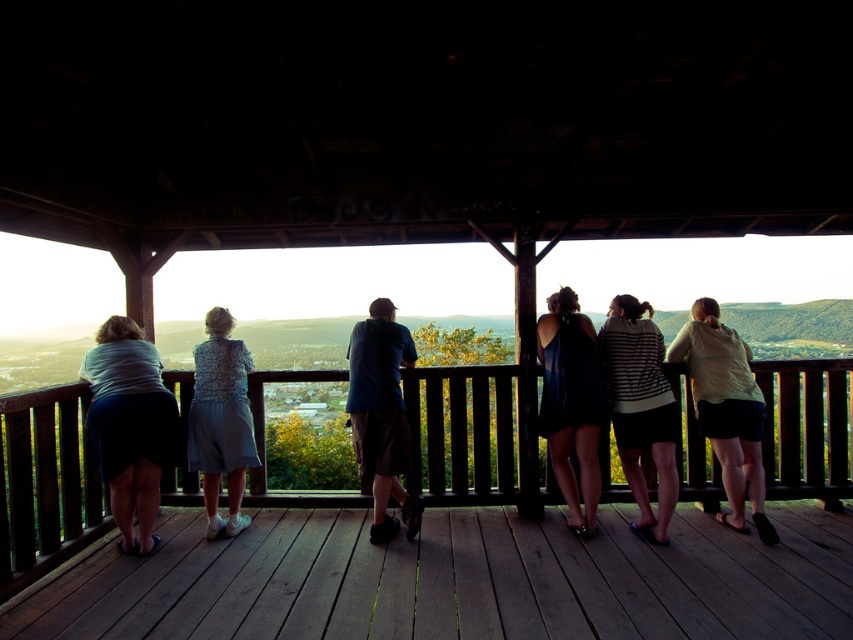
You are a photographer trying to capture a group photo of the six people on the wooden deck. You notice the light yellow shirt at center and the matte blue dress at center. To ensure both are clearly visible in the photo, which clothing item should you focus on more closely due to its width?

The light yellow shirt at center might be wider than matte blue dress at center, so focusing on the light yellow shirt at center would ensure it is clearly visible in the photo.